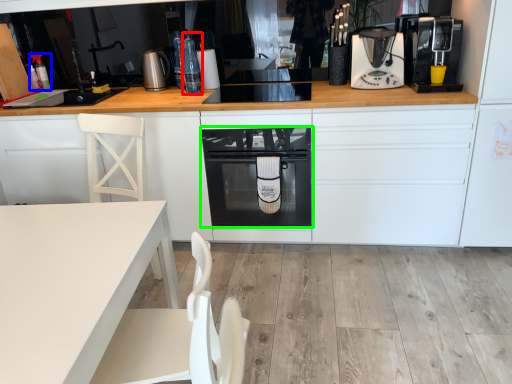
Question: Which is farther away from bottle (highlighted by a red box)? bottle (highlighted by a blue box) or home appliance (highlighted by a green box)?

Choices:
 (A) bottle
 (B) home appliance

Answer: (A)